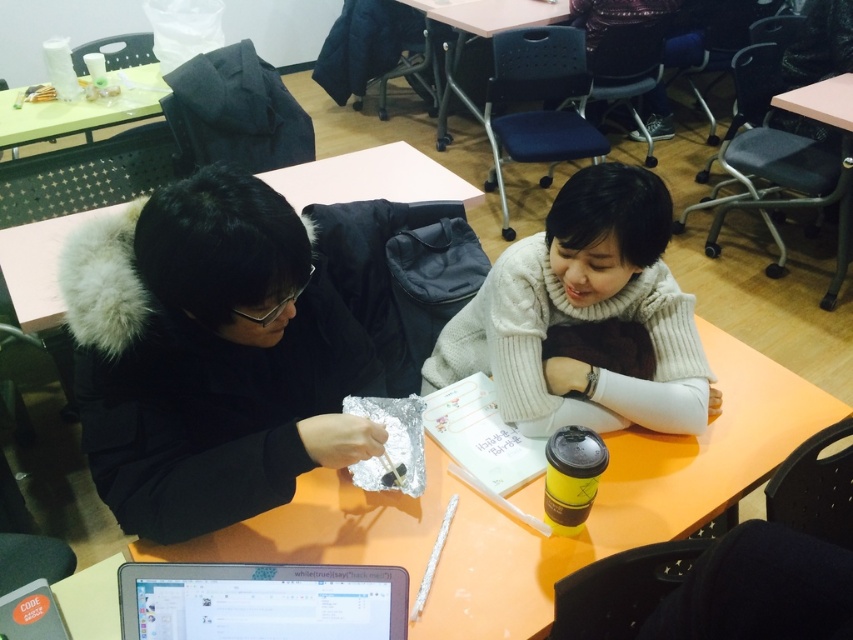
You are a delivery robot that needs to place a small package on the matte plastic table at center. The package is 1 foot in length. Can you safely place it on the table without hitting the silver metallic laptop at center?

The silver metallic laptop at center is 10.22 feet away from the matte plastic table at center. Since the package is only 1 foot long, there is sufficient space between them to place the package safely on the matte plastic table at center without any collision.

You are taking a photo of the two points on the table. Which point, point (294,582) or point (819,90), will appear larger in your photo?

Point (294,582) is closer to the camera than point (819,90), so it will appear larger in the photo.

You are organizing a study session and need to place a new textbook on the table. Considering the silver metallic laptop at center and the matte plastic table at center, which object has enough space to accommodate the textbook without overlapping?

The matte plastic table at center has enough space to accommodate the textbook without overlapping because it is larger than the silver metallic laptop at center.